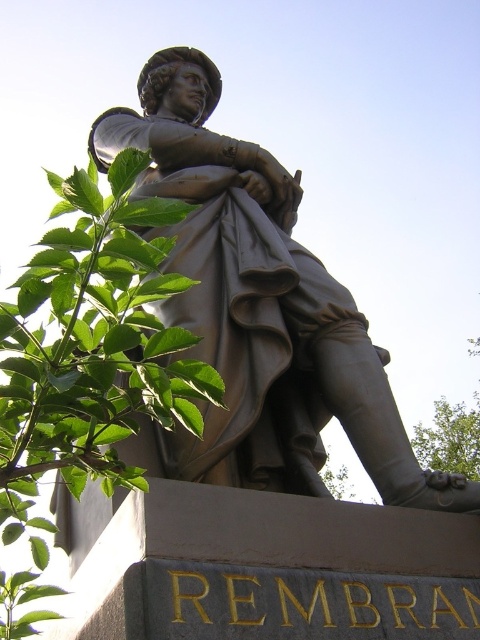
Which is more to the left, bronze statue at center or green leafy branch at upper left?

green leafy branch at upper left

Between bronze statue at center and green leafy branch at upper left, which one is positioned lower?

green leafy branch at upper left

Where is `bronze statue at center`? bronze statue at center is located at coordinates (260, 307).

Where is `bronze statue at center`? The width and height of the screenshot is (480, 640). bronze statue at center is located at coordinates (260, 307).